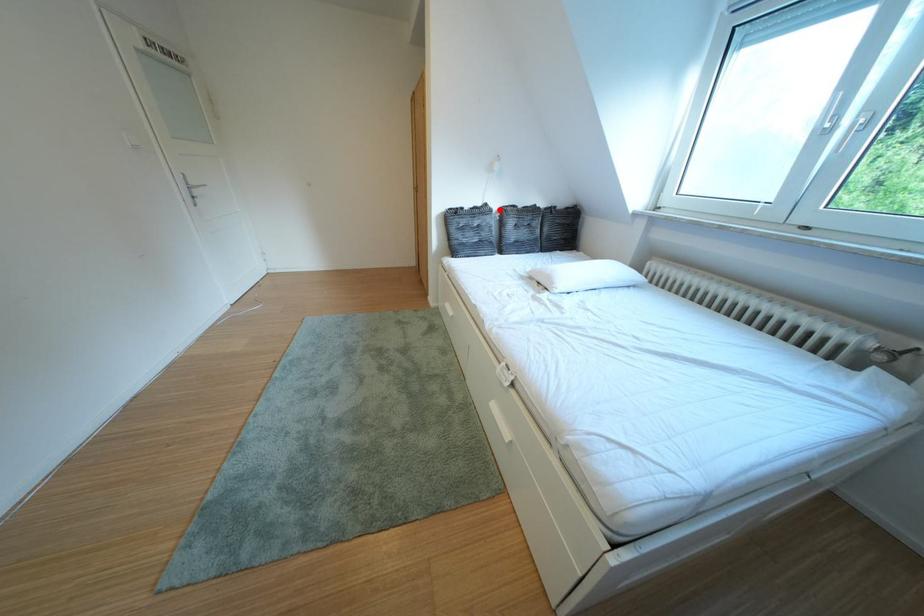
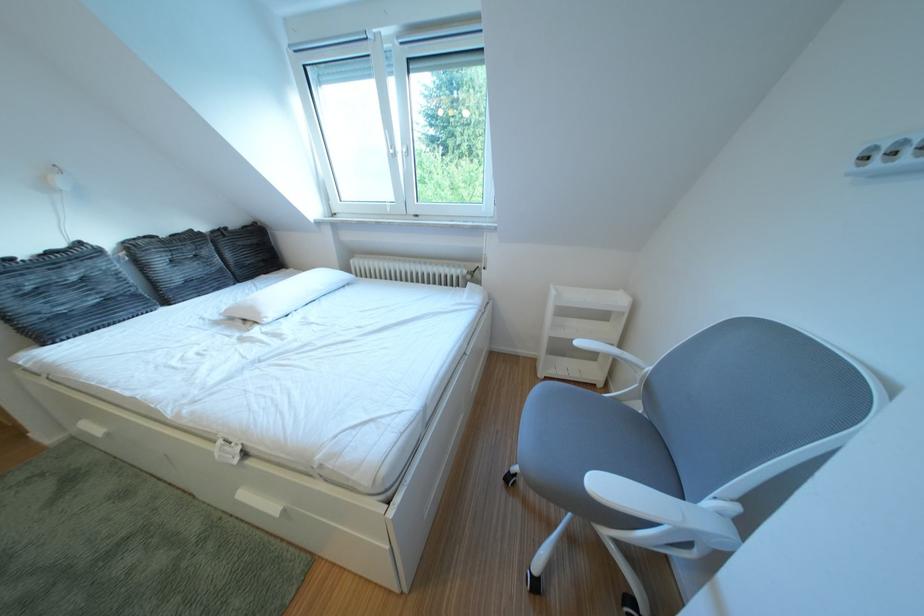
The point at the highlighted location is marked in the first image. Where is the corresponding point in the second image?

(93, 249)